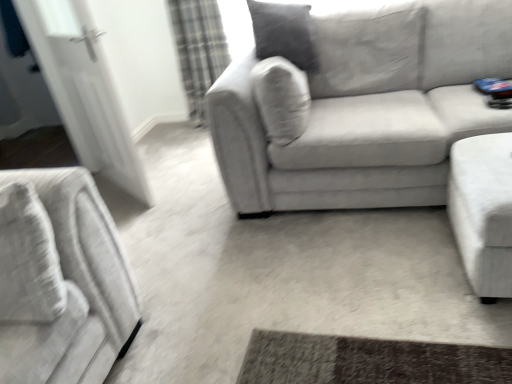
Find the location of a particular element. Image resolution: width=512 pixels, height=384 pixels. plaid fabric curtain at upper left is located at coordinates (198, 50).

In order to face velvet gray couch at center, which is the second studio couch from right to left, should I rotate leftwards or rightwards?

A 16.123 degree turn to the right will do.

Image resolution: width=512 pixels, height=384 pixels. In order to click on white glossy door at left in this screenshot , I will do `click(84, 91)`.

Is white fabric ottoman at right, arranged as the 1th studio couch when viewed from the right, situated inside white glossy door at left or outside?

white fabric ottoman at right, arranged as the 1th studio couch when viewed from the right, lies outside white glossy door at left.

Is white fabric ottoman at right, arranged as the 1th studio couch when viewed from the right, turned away from white glossy door at left?

No.

From a real-world perspective, is white fabric ottoman at right, which is counted as the second studio couch, starting from the left, physically above white glossy door at left?

Actually, white fabric ottoman at right, which is counted as the second studio couch, starting from the left, is physically below white glossy door at left in the real world.

Which object is further away from the camera, white fabric ottoman at right, arranged as the 1th studio couch when viewed from the right, or white glossy door at left?

Positioned behind is white glossy door at left.

Is point (452, 19) behind point (106, 65)?

No, it is not.

Considering the relative sizes of velvet gray couch at center, which is the second studio couch from right to left, and white glossy door at left in the image provided, is velvet gray couch at center, which is the second studio couch from right to left, wider than white glossy door at left?

Indeed, velvet gray couch at center, which is the second studio couch from right to left, has a greater width compared to white glossy door at left.

Can you tell me how much velvet gray couch at center, acting as the first studio couch starting from the left, and white glossy door at left differ in facing direction?

The angle between the facing direction of velvet gray couch at center, acting as the first studio couch starting from the left, and the facing direction of white glossy door at left is 39.6 degrees.

Is velvet gray couch at center, acting as the first studio couch starting from the left, facing away from white glossy door at left?

No.

From a real-world perspective, is white glossy door at left above or below white fabric ottoman at right, arranged as the 1th studio couch when viewed from the right?

From a real-world perspective, white glossy door at left is physically above white fabric ottoman at right, arranged as the 1th studio couch when viewed from the right.

Is white glossy door at left at the left side of white fabric ottoman at right, arranged as the 1th studio couch when viewed from the right?

Indeed, white glossy door at left is positioned on the left side of white fabric ottoman at right, arranged as the 1th studio couch when viewed from the right.

Is white glossy door at left surrounding white fabric ottoman at right, which is counted as the second studio couch, starting from the left?

No, white fabric ottoman at right, which is counted as the second studio couch, starting from the left, is not a part of white glossy door at left.

Is white glossy door at left oriented towards white fabric ottoman at right, which is counted as the second studio couch, starting from the left?

No, white glossy door at left is not aimed at white fabric ottoman at right, which is counted as the second studio couch, starting from the left.

Can you confirm if velvet gray couch at center, acting as the first studio couch starting from the left, is wider than white fabric ottoman at right, which is counted as the second studio couch, starting from the left?

Correct, the width of velvet gray couch at center, acting as the first studio couch starting from the left, exceeds that of white fabric ottoman at right, which is counted as the second studio couch, starting from the left.

Which object is positioned more to the right, velvet gray couch at center, acting as the first studio couch starting from the left, or white fabric ottoman at right, arranged as the 1th studio couch when viewed from the right?

white fabric ottoman at right, arranged as the 1th studio couch when viewed from the right.

From the image's perspective, does velvet gray couch at center, acting as the first studio couch starting from the left, appear higher than white fabric ottoman at right, arranged as the 1th studio couch when viewed from the right?

Yes.

Which of these two, white fabric ottoman at right, which is counted as the second studio couch, starting from the left, or velvet gray couch at center, which is the second studio couch from right to left, stands shorter?

white fabric ottoman at right, which is counted as the second studio couch, starting from the left.

From the image's perspective, does white fabric ottoman at right, arranged as the 1th studio couch when viewed from the right, appear higher than velvet gray couch at center, which is the second studio couch from right to left?

No, from the image's perspective, white fabric ottoman at right, arranged as the 1th studio couch when viewed from the right, is not over velvet gray couch at center, which is the second studio couch from right to left.

Based on their sizes in the image, would you say white fabric ottoman at right, which is counted as the second studio couch, starting from the left, is bigger or smaller than velvet gray couch at center, acting as the first studio couch starting from the left?

Considering their sizes, white fabric ottoman at right, which is counted as the second studio couch, starting from the left, takes up less space than velvet gray couch at center, acting as the first studio couch starting from the left.

Does point (200, 117) come farther from viewer compared to point (511, 166)?

That is True.

Does plaid fabric curtain at upper left have a larger size compared to white fabric ottoman at right, arranged as the 1th studio couch when viewed from the right?

Yes, plaid fabric curtain at upper left is bigger than white fabric ottoman at right, arranged as the 1th studio couch when viewed from the right.

Considering the relative sizes of plaid fabric curtain at upper left and white fabric ottoman at right, arranged as the 1th studio couch when viewed from the right, in the image provided, is plaid fabric curtain at upper left wider than white fabric ottoman at right, arranged as the 1th studio couch when viewed from the right,?

No.

Visually, is white glossy door at left positioned to the left or to the right of plaid fabric curtain at upper left?

From the image, it's evident that white glossy door at left is to the left of plaid fabric curtain at upper left.

Which of these two, white glossy door at left or plaid fabric curtain at upper left, is thinner?

With smaller width is white glossy door at left.

Between white glossy door at left and plaid fabric curtain at upper left, which one has smaller size?

white glossy door at left is smaller.

Is white glossy door at left aimed at plaid fabric curtain at upper left?

No, white glossy door at left does not turn towards plaid fabric curtain at upper left.

This screenshot has height=384, width=512. I want to click on the 2nd studio couch to the right of the white glossy door at left, counting from the anchor's position, so click(x=483, y=211).

Identify the location of the 1st studio couch in front of the white glossy door at left, counting from the anchor's position. click(358, 103).

From the image, which object appears to be nearer to velvet gray couch at center, which is the second studio couch from right to left, white fabric ottoman at right, arranged as the 1th studio couch when viewed from the right, or white glossy door at left?

white fabric ottoman at right, arranged as the 1th studio couch when viewed from the right, is positioned closer to the anchor velvet gray couch at center, which is the second studio couch from right to left.

Looking at the image, which one is located further to white fabric ottoman at right, arranged as the 1th studio couch when viewed from the right, plaid fabric curtain at upper left or velvet gray couch at center, acting as the first studio couch starting from the left?

plaid fabric curtain at upper left is positioned further to the anchor white fabric ottoman at right, arranged as the 1th studio couch when viewed from the right.

Looking at the image, which one is located further to plaid fabric curtain at upper left, white fabric ottoman at right, arranged as the 1th studio couch when viewed from the right, or white glossy door at left?

white fabric ottoman at right, arranged as the 1th studio couch when viewed from the right, is further to plaid fabric curtain at upper left.

Looking at the image, which one is located closer to white fabric ottoman at right, arranged as the 1th studio couch when viewed from the right, white glossy door at left or plaid fabric curtain at upper left?

white glossy door at left.

Based on their spatial positions, is plaid fabric curtain at upper left or white glossy door at left closer to white fabric ottoman at right, which is counted as the second studio couch, starting from the left?

white glossy door at left is closer to white fabric ottoman at right, which is counted as the second studio couch, starting from the left.

When comparing their distances from plaid fabric curtain at upper left, does white fabric ottoman at right, which is counted as the second studio couch, starting from the left, or velvet gray couch at center, which is the second studio couch from right to left, seem further?

white fabric ottoman at right, which is counted as the second studio couch, starting from the left, is further to plaid fabric curtain at upper left.

Estimate the real-world distances between objects in this image. Which object is further from white glossy door at left, plaid fabric curtain at upper left or white fabric ottoman at right, which is counted as the second studio couch, starting from the left?

white fabric ottoman at right, which is counted as the second studio couch, starting from the left, is positioned further to the anchor white glossy door at left.

When comparing their distances from white fabric ottoman at right, which is counted as the second studio couch, starting from the left, does velvet gray couch at center, acting as the first studio couch starting from the left, or white glossy door at left seem further?

Based on the image, white glossy door at left appears to be further to white fabric ottoman at right, which is counted as the second studio couch, starting from the left.

Where is `curtain between white glossy door at left and velvet gray couch at center, acting as the first studio couch starting from the left`? The image size is (512, 384). curtain between white glossy door at left and velvet gray couch at center, acting as the first studio couch starting from the left is located at coordinates click(x=198, y=50).

Find the location of a particular element. The height and width of the screenshot is (384, 512). studio couch between white fabric ottoman at right, arranged as the 1th studio couch when viewed from the right, and plaid fabric curtain at upper left, along the z-axis is located at coordinates (358, 103).

The height and width of the screenshot is (384, 512). I want to click on curtain between white glossy door at left and white fabric ottoman at right, arranged as the 1th studio couch when viewed from the right, from left to right, so click(198, 50).

The width and height of the screenshot is (512, 384). I want to click on studio couch between white glossy door at left and white fabric ottoman at right, arranged as the 1th studio couch when viewed from the right, in the horizontal direction, so click(x=358, y=103).